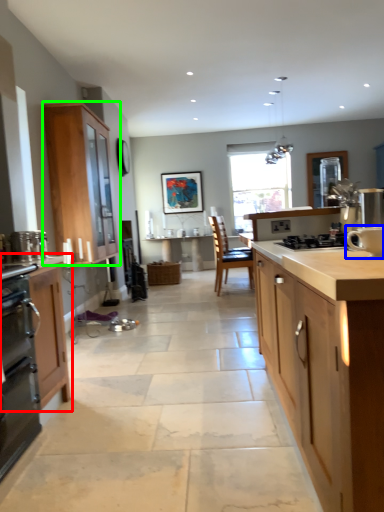
Question: Which object is the farthest from cabinetry (highlighted by a red box)? Choose among these: appliance (highlighted by a blue box) or cabinetry (highlighted by a green box).

Choices:
 (A) appliance
 (B) cabinetry

Answer: (B)